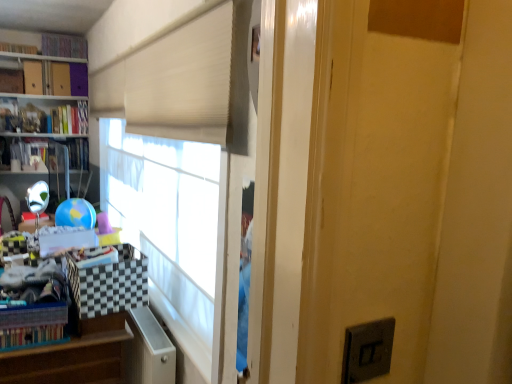
Identify the location of free point below matte purple bookcase at upper left (from a real-world perspective). (44, 91).